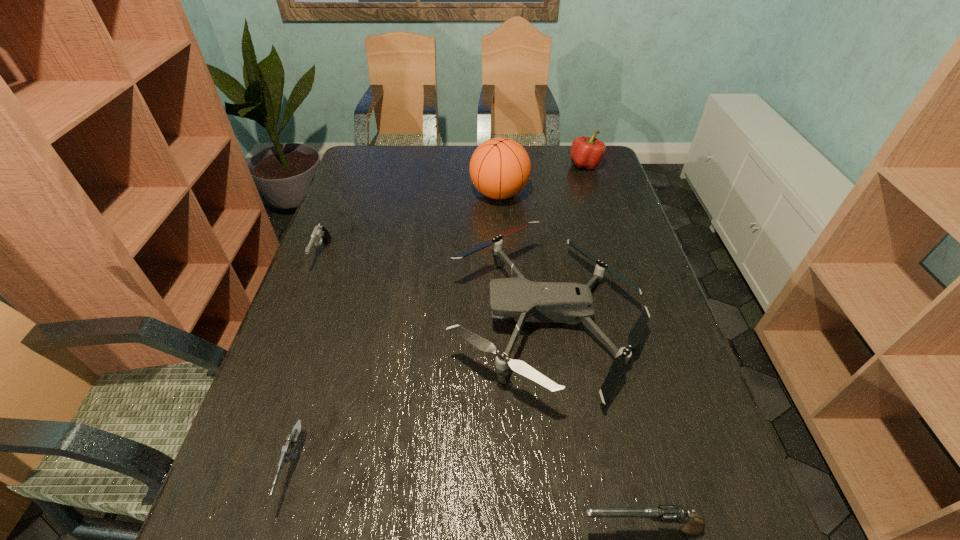
At what (x,y) coordinates should I click in order to perform the action: click on the second farthest object. Please return your answer as a coordinate pair (x, y). This screenshot has width=960, height=540. Looking at the image, I should click on (500, 168).

Identify the location of the tallest object. (500, 168).

Locate an element on the screen. This screenshot has height=540, width=960. the farthest object is located at coordinates (587, 152).

Where is `drone`? drone is located at coordinates (527, 301).

This screenshot has width=960, height=540. In order to click on the leftmost object in this screenshot , I will do `click(320, 233)`.

Find the location of a particular element. the farthest gun is located at coordinates (320, 233).

The image size is (960, 540). Find the location of `the nearest object`. the nearest object is located at coordinates (691, 524).

The image size is (960, 540). In order to click on the rightmost gun in this screenshot , I will do `click(691, 524)`.

This screenshot has height=540, width=960. I want to click on the shortest object, so click(289, 452).

Find the location of a particular element. The width and height of the screenshot is (960, 540). the fifth object from right to left is located at coordinates (289, 452).